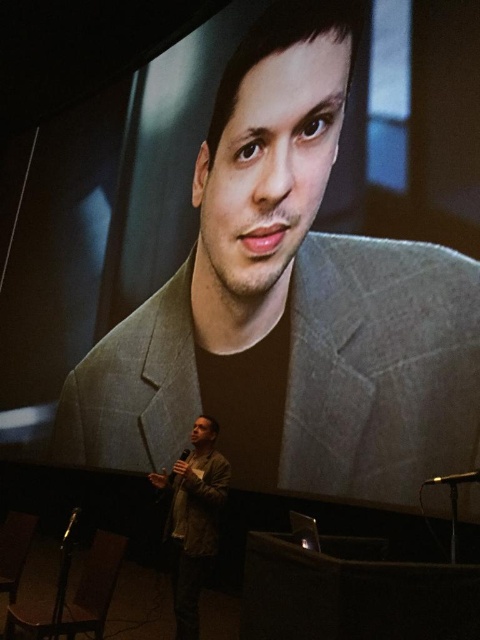
Question: Does gray checkered suit at center have a lesser width compared to leather jacket at center?

Choices:
 (A) no
 (B) yes

Answer: (A)

Question: Is gray checkered suit at center to the left of leather jacket at center from the viewer's perspective?

Choices:
 (A) no
 (B) yes

Answer: (A)

Question: Does gray checkered suit at center have a lesser width compared to leather jacket at center?

Choices:
 (A) yes
 (B) no

Answer: (B)

Question: Which point appears farthest from the camera in this image?

Choices:
 (A) (188, 465)
 (B) (301, 288)

Answer: (B)